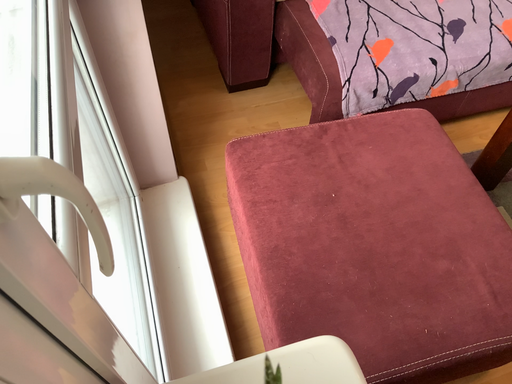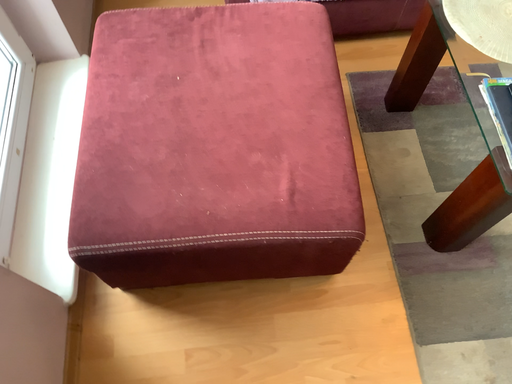
Question: How did the camera likely rotate when shooting the video?

Choices:
 (A) rotated downward
 (B) rotated upward

Answer: (A)